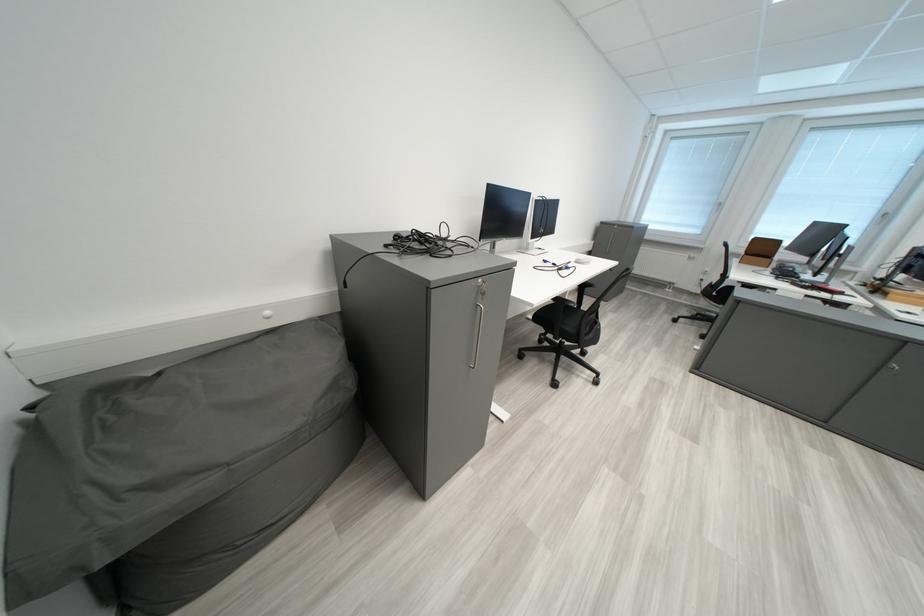
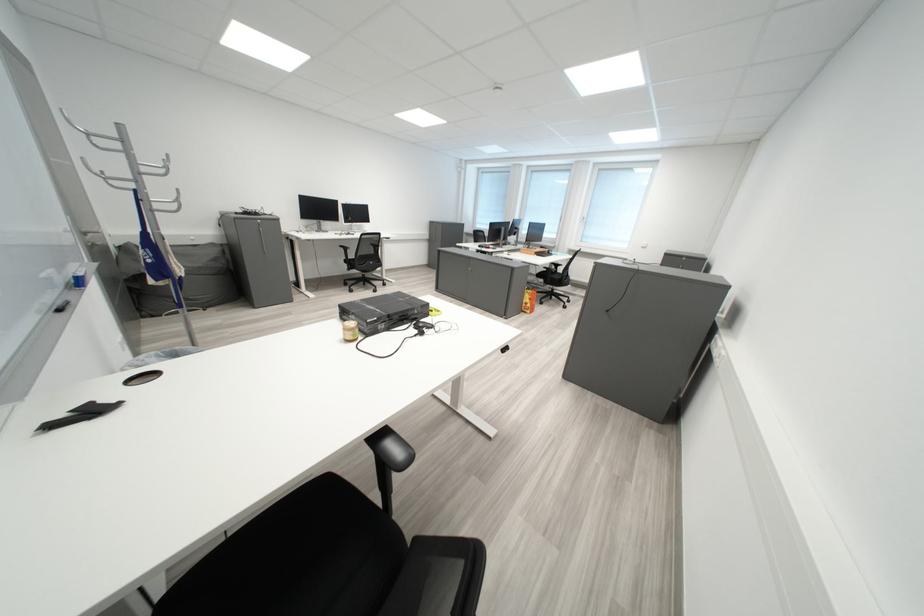
The point at (346, 387) is marked in the first image. Where is the corresponding point in the second image?

(228, 262)